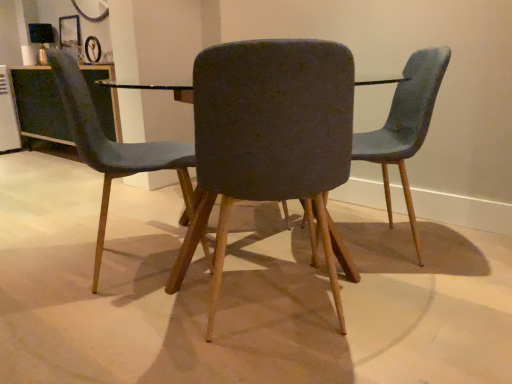
Question: Considering the relative positions of velvet blue chair at left, the 1th chair in the left-to-right sequence, and white plastic appliance at left in the image provided, is velvet blue chair at left, the 1th chair in the left-to-right sequence, behind white plastic appliance at left?

Choices:
 (A) no
 (B) yes

Answer: (A)

Question: Does velvet blue chair at left, which appears as the third chair when viewed from the right, contain white plastic appliance at left?

Choices:
 (A) no
 (B) yes

Answer: (A)

Question: Considering the relative sizes of velvet blue chair at left, the 1th chair in the left-to-right sequence, and white plastic appliance at left in the image provided, is velvet blue chair at left, the 1th chair in the left-to-right sequence, thinner than white plastic appliance at left?

Choices:
 (A) yes
 (B) no

Answer: (B)

Question: Can you confirm if velvet blue chair at left, which appears as the third chair when viewed from the right, is positioned to the right of white plastic appliance at left?

Choices:
 (A) yes
 (B) no

Answer: (A)

Question: From the image's perspective, is velvet blue chair at left, which appears as the third chair when viewed from the right, below white plastic appliance at left?

Choices:
 (A) yes
 (B) no

Answer: (A)

Question: Would you say matte black table at center is to the left or to the right of textured gray chair at center, placed as the 3th chair when sorted from left to right, in the picture?

Choices:
 (A) right
 (B) left

Answer: (B)

Question: In terms of height, does matte black table at center look taller or shorter compared to textured gray chair at center, placed as the 3th chair when sorted from left to right?

Choices:
 (A) short
 (B) tall

Answer: (A)

Question: Considering the positions of point (376, 82) and point (400, 137), is point (376, 82) closer or farther from the camera than point (400, 137)?

Choices:
 (A) farther
 (B) closer

Answer: (A)

Question: Is matte black table at center wider or thinner than textured gray chair at center, placed as the 1th chair when sorted from right to left?

Choices:
 (A) thin
 (B) wide

Answer: (B)

Question: In terms of height, does velvet blue chair at left, which appears as the third chair when viewed from the right, look taller or shorter compared to clear glass table at upper left?

Choices:
 (A) short
 (B) tall

Answer: (B)

Question: Relative to clear glass table at upper left, is velvet blue chair at left, the 1th chair in the left-to-right sequence, in front or behind?

Choices:
 (A) front
 (B) behind

Answer: (A)

Question: From a real-world perspective, is velvet blue chair at left, the 1th chair in the left-to-right sequence, above or below clear glass table at upper left?

Choices:
 (A) above
 (B) below

Answer: (A)

Question: Is point (81, 109) positioned closer to the camera than point (49, 96)?

Choices:
 (A) farther
 (B) closer

Answer: (B)

Question: From their relative heights in the image, would you say clear glass table at upper left is taller or shorter than white plastic appliance at left?

Choices:
 (A) tall
 (B) short

Answer: (B)

Question: In the image, is clear glass table at upper left on the left side or the right side of white plastic appliance at left?

Choices:
 (A) left
 (B) right

Answer: (B)